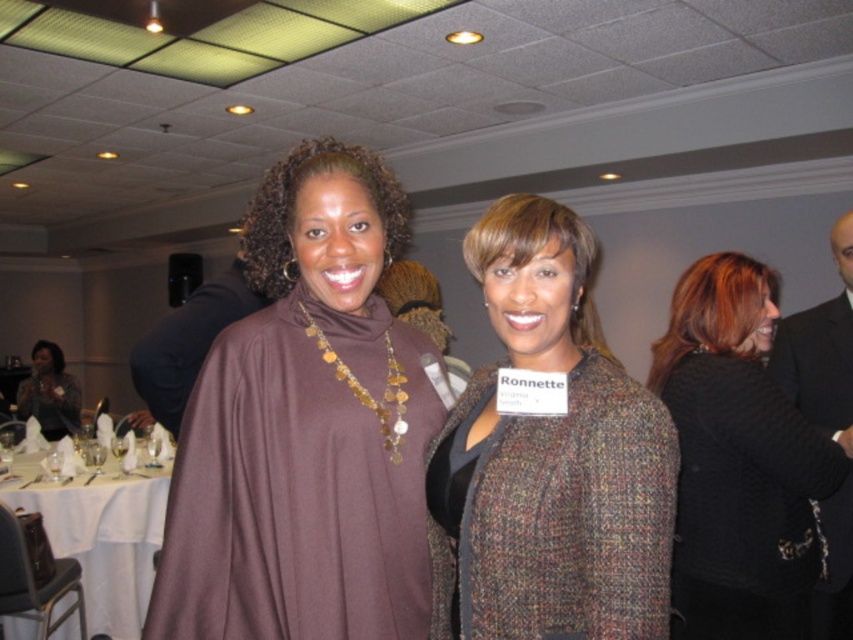
Question: Which is farther from the multicolored tweed jacket at center?

Choices:
 (A) white cloth at lower left
 (B) brown matte turtleneck sweater at center
 (C) matte black dress at left
 (D) black textured sweater at right

Answer: (C)

Question: Which point appears closest to the camera in this image?

Choices:
 (A) (38, 344)
 (B) (405, 577)
 (C) (770, 292)

Answer: (B)

Question: Does black textured sweater at right lie in front of matte black dress at left?

Choices:
 (A) yes
 (B) no

Answer: (A)

Question: Which point is farther to the camera?

Choices:
 (A) brown matte turtleneck sweater at center
 (B) multicolored tweed jacket at center
 (C) black textured sweater at right

Answer: (C)

Question: Is the position of brown matte turtleneck sweater at center more distant than that of white cloth at lower left?

Choices:
 (A) no
 (B) yes

Answer: (A)

Question: Can you confirm if multicolored tweed jacket at center is positioned above black suit at right?

Choices:
 (A) no
 (B) yes

Answer: (B)